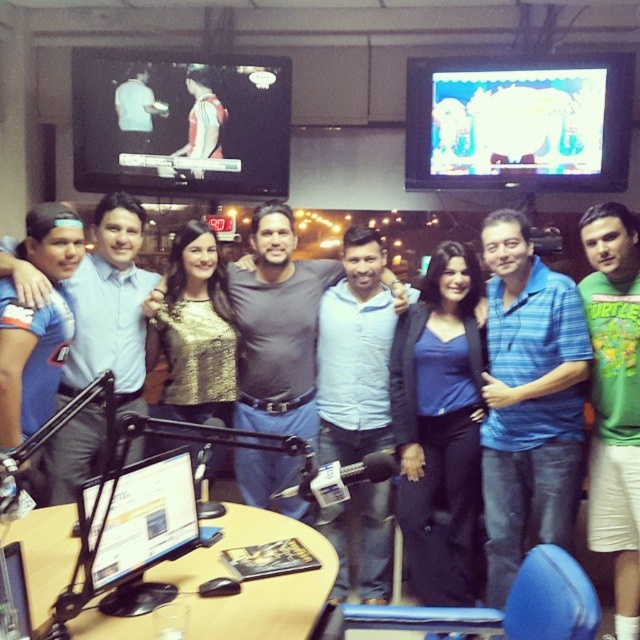
Question: Does green cotton shirt at center have a lesser width compared to black glossy monitor at center?

Choices:
 (A) no
 (B) yes

Answer: (B)

Question: Which object appears closest to the camera in this image?

Choices:
 (A) blue matte shirt at center
 (B) green cotton shirt at center
 (C) blue denim jeans at center

Answer: (B)

Question: Does blue matte shirt at center come in front of blue denim jeans at center?

Choices:
 (A) yes
 (B) no

Answer: (B)

Question: Does blue matte shirt at center have a smaller size compared to blue denim jeans at center?

Choices:
 (A) no
 (B) yes

Answer: (B)

Question: Which of the following is the farthest from the observer?

Choices:
 (A) (252, 380)
 (B) (413, 346)
 (C) (336, 364)

Answer: (C)

Question: Among these points, which one is farthest from the camera?

Choices:
 (A) (54, 365)
 (B) (483, 221)

Answer: (B)